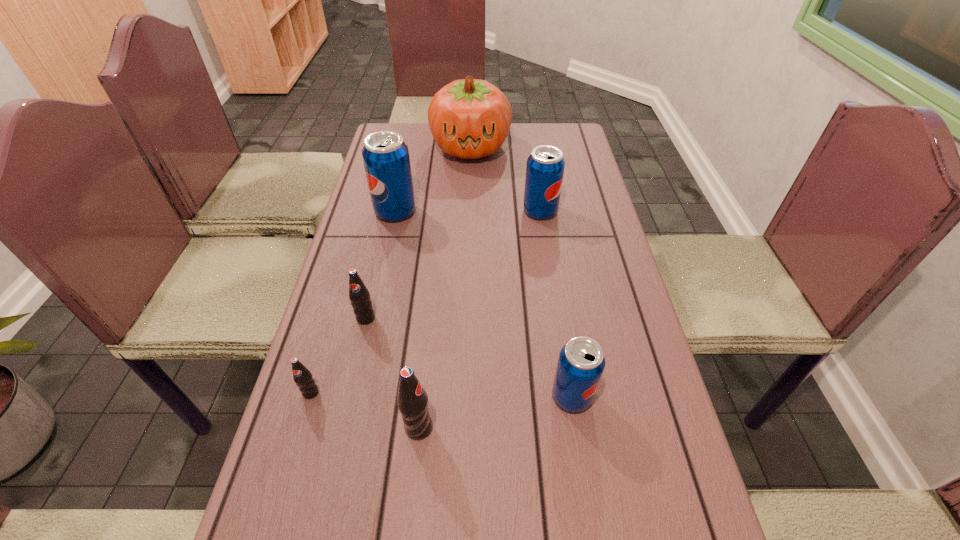
The height and width of the screenshot is (540, 960). In order to click on object that stands as the sixth closest to the second black pop from left to right in this screenshot , I will do `click(469, 118)`.

Select which object is the second closest to the shortest object. Please provide its 2D coordinates. Your answer should be formatted as a tuple, i.e. [(x, y)], where the tuple contains the x and y coordinates of a point satisfying the conditions above.

[(412, 400)]

Identify the location of pop that is the fifth closest to the leftmost blue pop soda. (581, 362).

Identify the location of pop that stands as the second closest to the second black pop from left to right. This screenshot has width=960, height=540. (412, 400).

Identify which blue pop soda is located as the third nearest to the leftmost pop. Please provide its 2D coordinates. Your answer should be formatted as a tuple, i.e. [(x, y)], where the tuple contains the x and y coordinates of a point satisfying the conditions above.

[(545, 166)]

This screenshot has width=960, height=540. In order to click on the closest blue pop soda to the smallest blue pop soda in this screenshot , I will do `click(545, 166)`.

Identify which black pop is the second closest to the biggest black pop. Please provide its 2D coordinates. Your answer should be formatted as a tuple, i.e. [(x, y)], where the tuple contains the x and y coordinates of a point satisfying the conditions above.

[(359, 295)]

Identify which black pop is the second nearest to the fourth nearest pop. Please provide its 2D coordinates. Your answer should be formatted as a tuple, i.e. [(x, y)], where the tuple contains the x and y coordinates of a point satisfying the conditions above.

[(412, 400)]

Identify the location of vacant area that satisfies the following two spatial constraints: 1. on the front side of the nearest blue pop soda; 2. on the left side of the tallest pop. Image resolution: width=960 pixels, height=540 pixels. (355, 396).

Locate an element on the screen. The image size is (960, 540). vacant position in the image that satisfies the following two spatial constraints: 1. on the front side of the second smallest blue pop soda; 2. on the left side of the nearest blue pop soda is located at coordinates (568, 396).